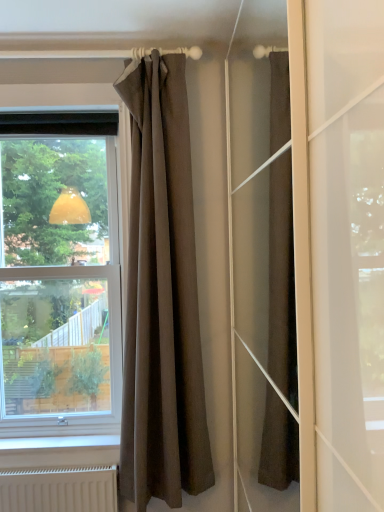
The height and width of the screenshot is (512, 384). What do you see at coordinates (59, 275) in the screenshot?
I see `transparent glass window at left` at bounding box center [59, 275].

Where is `transparent glass window at left`? The height and width of the screenshot is (512, 384). transparent glass window at left is located at coordinates coord(59,275).

What is the approximate width of brown textured curtain at upper center?

It is 7.63 inches.

What do you see at coordinates (162, 296) in the screenshot? I see `brown textured curtain at upper center` at bounding box center [162, 296].

The image size is (384, 512). Find the location of `brown textured curtain at upper center`. brown textured curtain at upper center is located at coordinates (162, 296).

Find the location of a particular element. The height and width of the screenshot is (512, 384). transparent glass window at left is located at coordinates (59, 275).

Is brown textured curtain at upper center at the left side of transparent glass window at left?

In fact, brown textured curtain at upper center is to the right of transparent glass window at left.

Is brown textured curtain at upper center positioned in front of transparent glass window at left?

Yes.

Does point (197, 332) lie in front of point (85, 201)?

Yes, it is.

From the image's perspective, between brown textured curtain at upper center and transparent glass window at left, who is located below?

brown textured curtain at upper center appears lower in the image.

Consider the image. From a real-world perspective, is brown textured curtain at upper center positioned under transparent glass window at left based on gravity?

Correct, in the physical world, brown textured curtain at upper center is lower than transparent glass window at left.

Considering the relative sizes of brown textured curtain at upper center and transparent glass window at left in the image provided, is brown textured curtain at upper center thinner than transparent glass window at left?

Yes.

Considering the relative sizes of brown textured curtain at upper center and transparent glass window at left in the image provided, is brown textured curtain at upper center shorter than transparent glass window at left?

No, brown textured curtain at upper center is not shorter than transparent glass window at left.

Does brown textured curtain at upper center have a larger size compared to transparent glass window at left?

No, brown textured curtain at upper center is not bigger than transparent glass window at left.

Is brown textured curtain at upper center surrounding transparent glass window at left?

No.

Is brown textured curtain at upper center far away from transparent glass window at left?

No, brown textured curtain at upper center is in close proximity to transparent glass window at left.

Is brown textured curtain at upper center oriented away from transparent glass window at left?

No.

Where is `curtain that is on the right side of transparent glass window at left`? The width and height of the screenshot is (384, 512). curtain that is on the right side of transparent glass window at left is located at coordinates (162, 296).

In the image, is transparent glass window at left on the left side or the right side of brown textured curtain at upper center?

transparent glass window at left is positioned on brown textured curtain at upper center's left side.

Is the depth of transparent glass window at left greater than that of brown textured curtain at upper center?

Yes, the depth of transparent glass window at left is greater than that of brown textured curtain at upper center.

Does point (43, 320) come in front of point (183, 308)?

No, it is behind (183, 308).

From the image's perspective, is transparent glass window at left above or below brown textured curtain at upper center?

From the image's perspective, transparent glass window at left appears above brown textured curtain at upper center.

From the picture: From a real-world perspective, does transparent glass window at left sit lower than brown textured curtain at upper center?

No, from a real-world perspective, transparent glass window at left is not under brown textured curtain at upper center.

Is transparent glass window at left wider than brown textured curtain at upper center?

Yes.

Considering the sizes of objects transparent glass window at left and brown textured curtain at upper center in the image provided, who is shorter, transparent glass window at left or brown textured curtain at upper center?

Standing shorter between the two is transparent glass window at left.

Which of these two, transparent glass window at left or brown textured curtain at upper center, is bigger?

With larger size is transparent glass window at left.

Is transparent glass window at left situated inside brown textured curtain at upper center or outside?

transparent glass window at left cannot be found inside brown textured curtain at upper center.

Is transparent glass window at left directly adjacent to brown textured curtain at upper center?

They are not placed beside each other.

Is transparent glass window at left facing away from brown textured curtain at upper center?

No, transparent glass window at left's orientation is not away from brown textured curtain at upper center.

What's the angular difference between transparent glass window at left and brown textured curtain at upper center's facing directions?

The facing directions of transparent glass window at left and brown textured curtain at upper center are 0.000852 degrees apart.

Find the location of `window behind the brown textured curtain at upper center`. window behind the brown textured curtain at upper center is located at coordinates (59, 275).

You are a GUI agent. You are given a task and a screenshot of the screen. Output one action in this format:
    pyautogui.click(x=<x>, y=<y>)
    Task: Click on the window on the left of brown textured curtain at upper center
    This screenshot has width=384, height=512.
    Given the screenshot: What is the action you would take?
    pyautogui.click(x=59, y=275)

What are the coordinates of `curtain directly beneath the transparent glass window at left (from a real-world perspective)` in the screenshot? It's located at (162, 296).